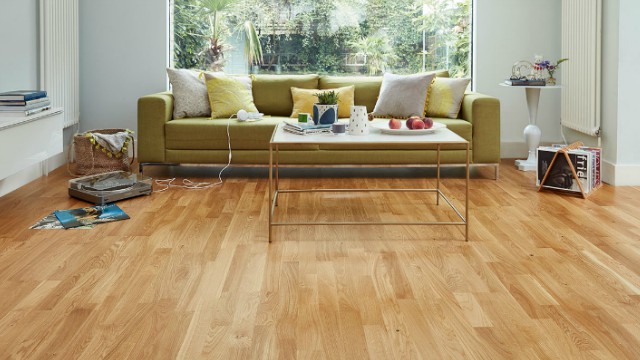
In order to click on left armrest in this screenshot , I will do `click(490, 108)`.